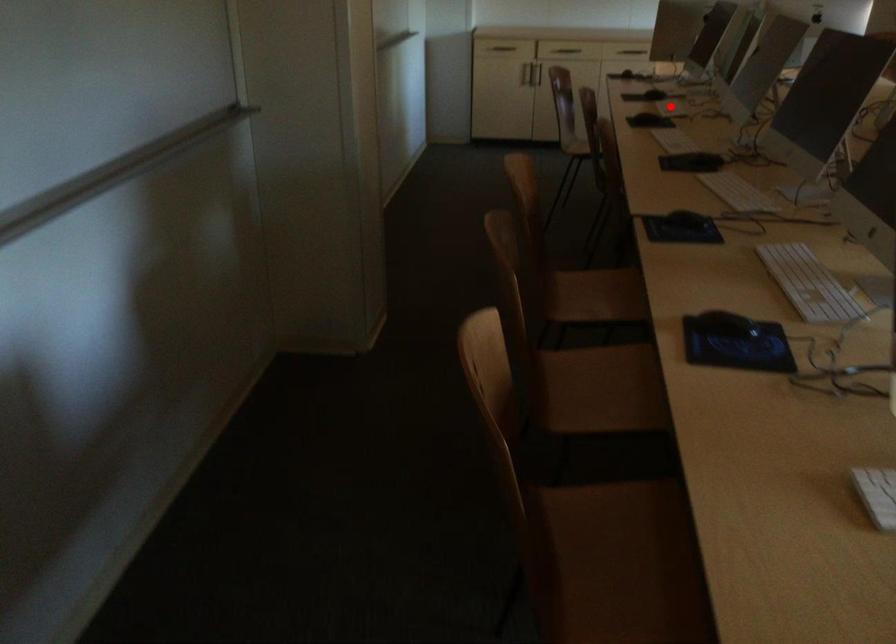
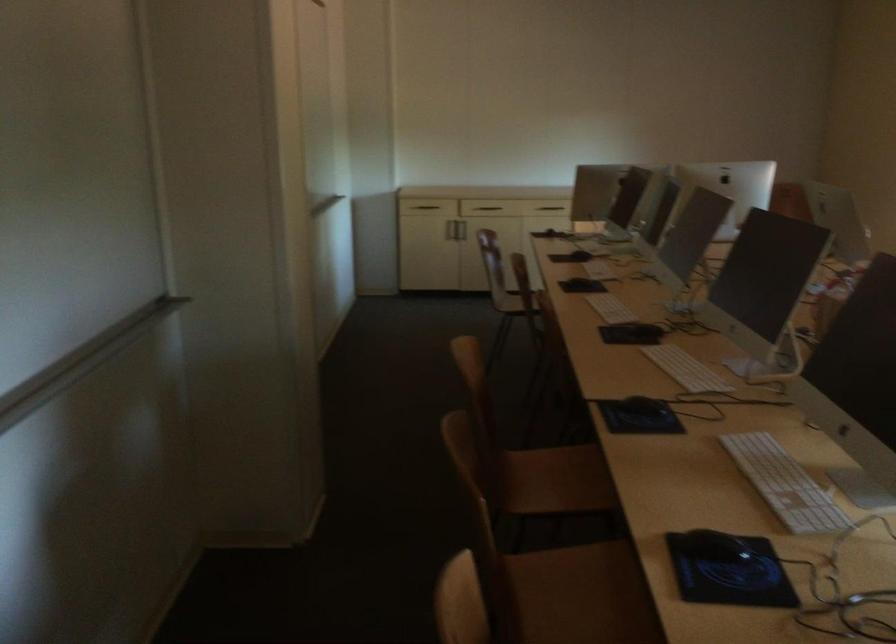
The point at the highlighted location is marked in the first image. Where is the corresponding point in the second image?

(599, 269)